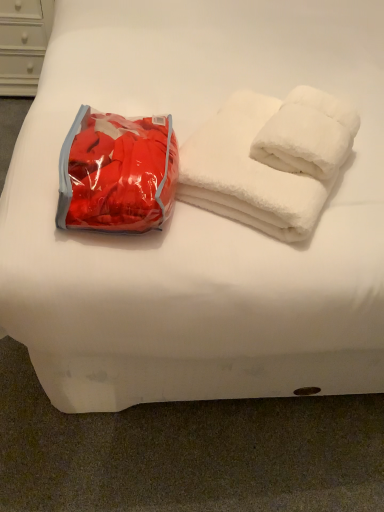
Question: Is white fluffy towels at upper right at the left side of matte red bean bag chair at left?

Choices:
 (A) yes
 (B) no

Answer: (B)

Question: From the image's perspective, is white fluffy towels at upper right located beneath matte red bean bag chair at left?

Choices:
 (A) yes
 (B) no

Answer: (B)

Question: Is white fluffy towels at upper right at the right side of matte red bean bag chair at left?

Choices:
 (A) no
 (B) yes

Answer: (B)

Question: Is the depth of white fluffy towels at upper right less than that of matte red bean bag chair at left?

Choices:
 (A) yes
 (B) no

Answer: (B)

Question: Does white fluffy towels at upper right turn towards matte red bean bag chair at left?

Choices:
 (A) no
 (B) yes

Answer: (A)

Question: Can you confirm if white fluffy towels at upper right is thinner than matte red bean bag chair at left?

Choices:
 (A) yes
 (B) no

Answer: (B)

Question: Is the surface of matte red bean bag chair at left in direct contact with white fluffy towels at upper right?

Choices:
 (A) yes
 (B) no

Answer: (B)

Question: From a real-world perspective, is matte red bean bag chair at left below white fluffy towels at upper right?

Choices:
 (A) no
 (B) yes

Answer: (A)

Question: Can you confirm if matte red bean bag chair at left is thinner than white fluffy towels at upper right?

Choices:
 (A) yes
 (B) no

Answer: (A)

Question: Does matte red bean bag chair at left have a larger size compared to white fluffy towels at upper right?

Choices:
 (A) no
 (B) yes

Answer: (A)

Question: Is matte red bean bag chair at left not inside white fluffy towels at upper right?

Choices:
 (A) yes
 (B) no

Answer: (A)

Question: Is matte red bean bag chair at left oriented away from white fluffy towels at upper right?

Choices:
 (A) no
 (B) yes

Answer: (A)

Question: In the image, is matte red bean bag chair at left on the left side or the right side of white fluffy towels at upper right?

Choices:
 (A) left
 (B) right

Answer: (A)